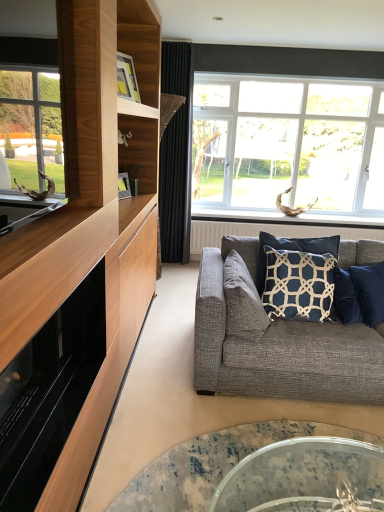
I want to click on free space above white textured radiator at center (from a real-world perspective), so click(x=289, y=224).